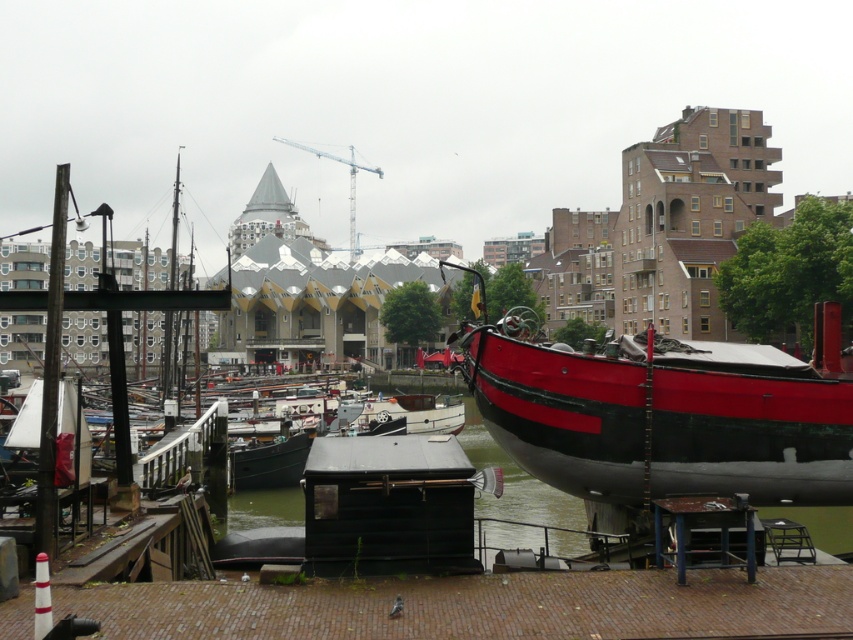
You are a dock worker who needs to load cargo onto both the matte black boat at center and the white glossy boat at center. Considering their sizes, which boat can carry more cargo?

The white glossy boat at center is larger than the matte black boat at center, so it can carry more cargo.

From the picture: You are a harbor worker who needs to tow a boat to a repair dock. You have two options available for towing, the red polished wood boat at right and the white glossy boat at center. Given that the towing equipment can only handle boats wider than 10 meters, which boat should you choose based on their widths?

The red polished wood boat at right has a greater width than the white glossy boat at center, so you should choose the red polished wood boat at right for towing since it is wider and likely meets the equipment requirement.

You are standing at the dock in the harbor scene. There are two points marked on the dock, one at coordinates point [625,476] and another at point [450,417]. If you look towards the water, which point would appear closer to you?

Point [625,476] is in front of point [450,417], so it would appear closer to you when looking towards the water.